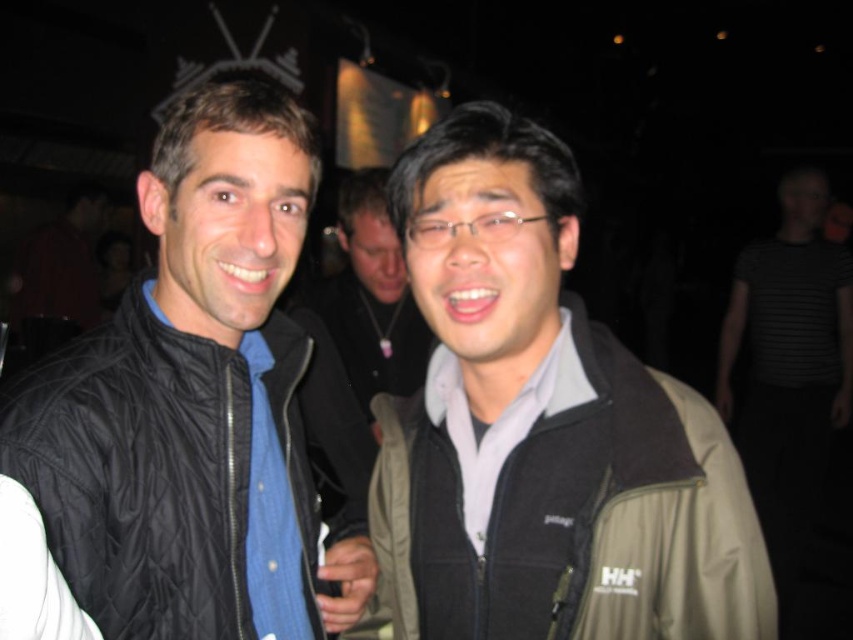
Question: Which object is closer to the camera taking this photo?

Choices:
 (A) matte gray jacket at center
 (B) black striped shirt at right
 (C) khaki fleece jacket at center
 (D) black quilted vest at left

Answer: (C)

Question: Observing the image, what is the correct spatial positioning of khaki fleece jacket at center in reference to black striped shirt at right?

Choices:
 (A) below
 (B) above

Answer: (B)

Question: Which point is farther to the camera?

Choices:
 (A) (175, 307)
 (B) (373, 214)
 (C) (780, 257)

Answer: (C)

Question: From the image, what is the correct spatial relationship of black striped shirt at right in relation to matte gray jacket at center?

Choices:
 (A) below
 (B) above

Answer: (A)

Question: Is khaki fleece jacket at center behind matte gray jacket at center?

Choices:
 (A) yes
 (B) no

Answer: (B)

Question: Which object appears farthest from the camera in this image?

Choices:
 (A) khaki fleece jacket at center
 (B) black quilted vest at left
 (C) matte gray jacket at center
 (D) black striped shirt at right

Answer: (D)